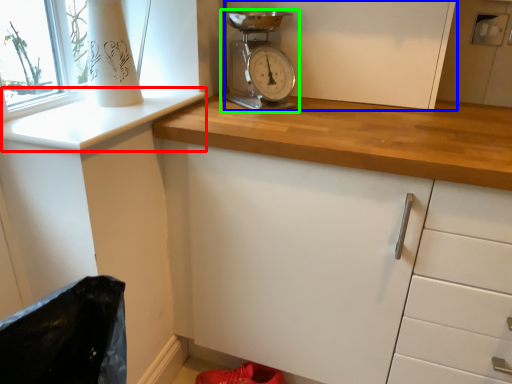
Question: Which is farther away from window sill (highlighted by a red box)? cabinetry (highlighted by a blue box) or home appliance (highlighted by a green box)?

Choices:
 (A) cabinetry
 (B) home appliance

Answer: (A)